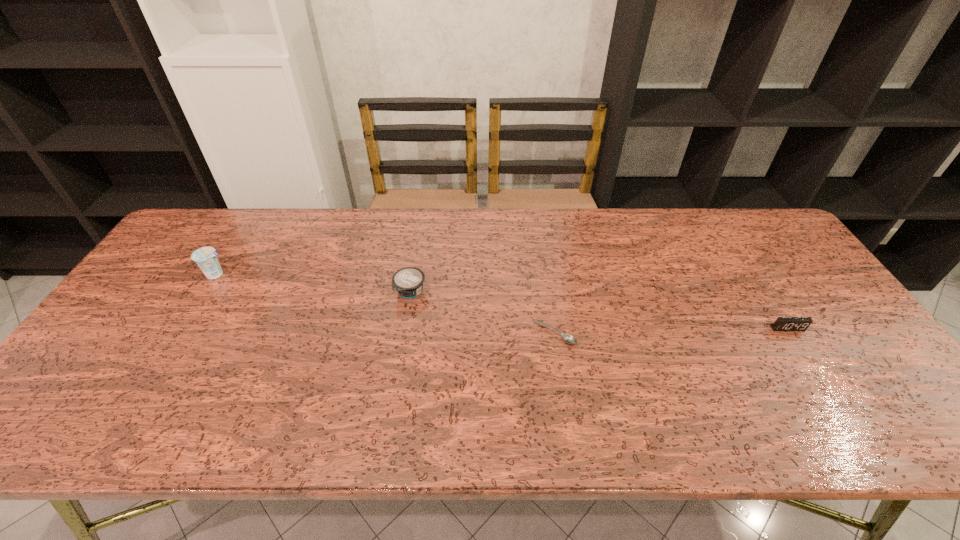
Locate an element on the screen. vacant space that's between the third object from left to right and the third object from right to left is located at coordinates (x=483, y=313).

Identify the location of empty space between the shortest object and the leftmost object. (386, 304).

Where is `free space that is in between the second shortest object and the third object from left to right`? This screenshot has width=960, height=540. free space that is in between the second shortest object and the third object from left to right is located at coordinates (671, 330).

This screenshot has height=540, width=960. I want to click on empty space that is in between the soupspoon and the second object from left to right, so click(483, 313).

At what (x,y) coordinates should I click in order to perform the action: click on free area in between the taller yogurt and the alarm clock. Please return your answer as a coordinate pair (x, y). This screenshot has width=960, height=540. Looking at the image, I should click on (502, 301).

Where is `free space between the rightmost object and the tallest object`? This screenshot has width=960, height=540. free space between the rightmost object and the tallest object is located at coordinates (502, 301).

The image size is (960, 540). In order to click on free space between the alarm clock and the third shortest object in this screenshot , I will do `click(599, 310)`.

The width and height of the screenshot is (960, 540). I want to click on free space that is in between the third object from left to right and the rightmost object, so click(x=671, y=330).

Image resolution: width=960 pixels, height=540 pixels. I want to click on vacant space in between the tallest object and the third shortest object, so click(x=313, y=283).

Choose which object is the third nearest neighbor to the tallest object. Please provide its 2D coordinates. Your answer should be formatted as a tuple, i.e. [(x, y)], where the tuple contains the x and y coordinates of a point satisfying the conditions above.

[(782, 323)]